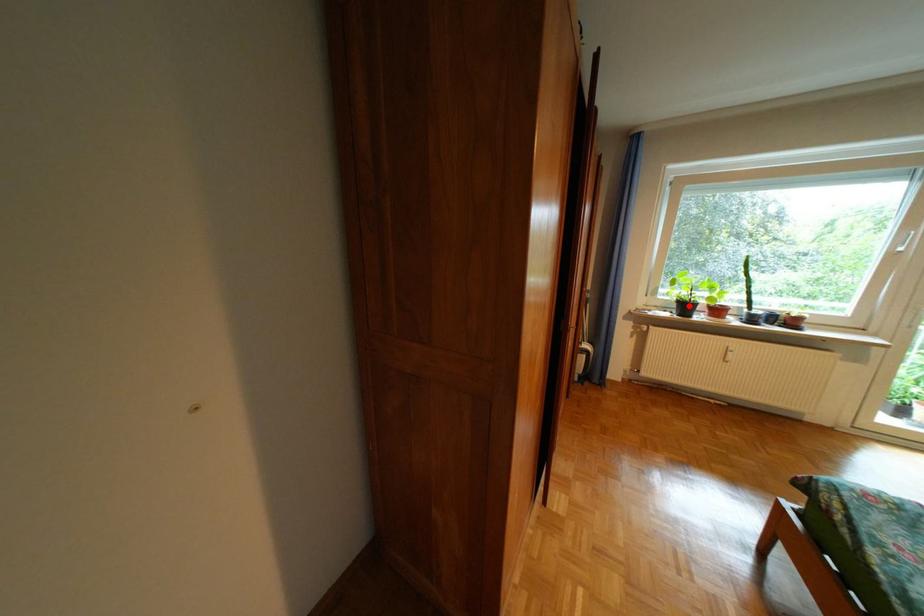
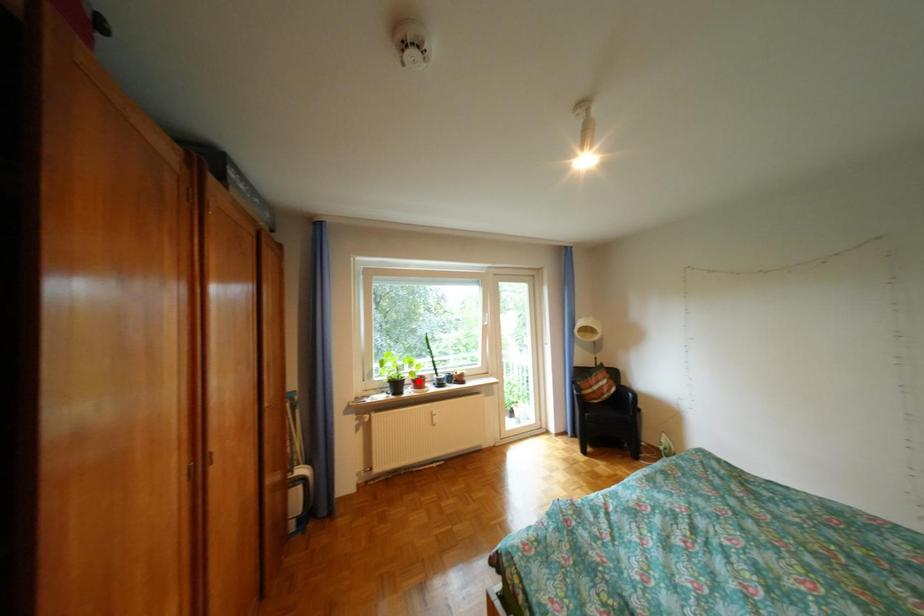
I am providing you with two images of the same scene from different viewpoints. A red point is marked on the first image and another point is marked on the second image. Do the highlighted points in image1 and image2 indicate the same real-world spot?

No